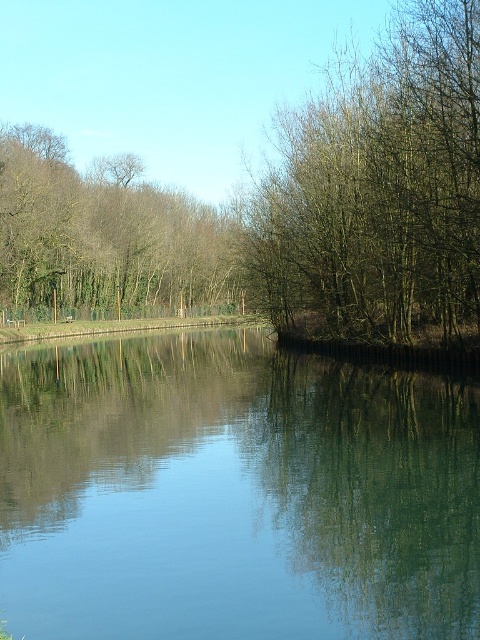
Does bare branches at center have a lesser width compared to brown leafless trees at upper left?

Yes, bare branches at center is thinner than brown leafless trees at upper left.

This screenshot has width=480, height=640. I want to click on bare branches at center, so click(380, 193).

Which is behind, point (156, 636) or point (282, 262)?

The point (282, 262) is more distant.

Is the position of transparent water at center less distant than that of bare branches at center?

Yes, transparent water at center is in front of bare branches at center.

Between point (240, 449) and point (362, 259), which one is positioned behind?

The point (362, 259) is more distant.

Image resolution: width=480 pixels, height=640 pixels. Find the location of `transparent water at center`. transparent water at center is located at coordinates (233, 492).

Between transparent water at center and brown leafless trees at upper left, which one has less height?

transparent water at center is shorter.

Who is positioned more to the right, transparent water at center or brown leafless trees at upper left?

transparent water at center is more to the right.

Between point (338, 596) and point (194, 216), which one is positioned in front?

Point (338, 596) is in front.

The image size is (480, 640). Identify the location of transparent water at center. (233, 492).